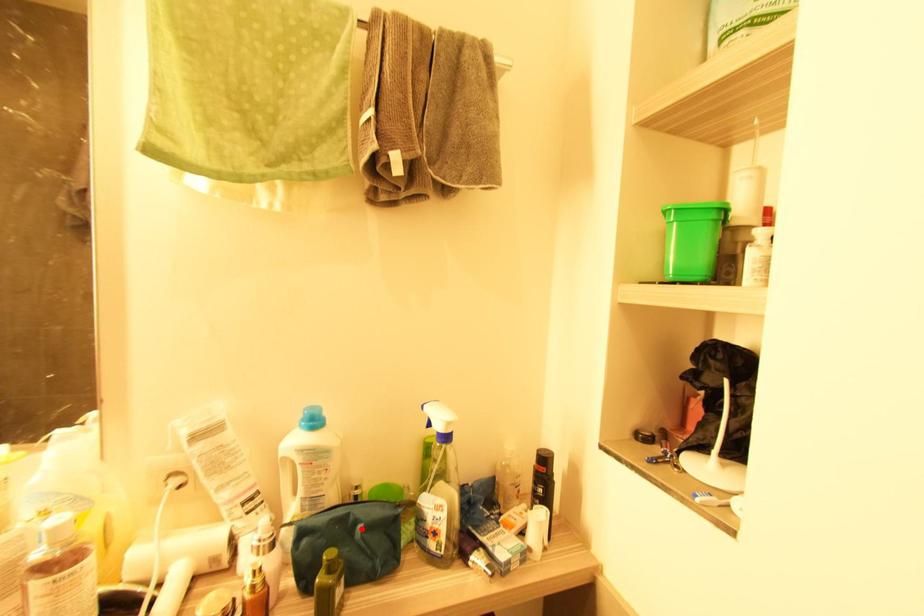
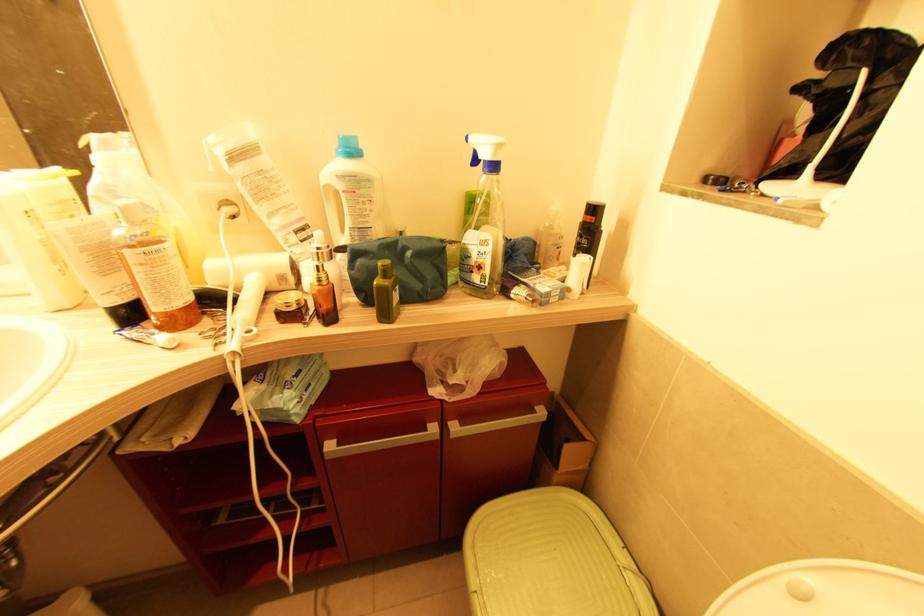
Locate, in the second image, the point that corresponds to the highlighted location in the first image.

(409, 254)